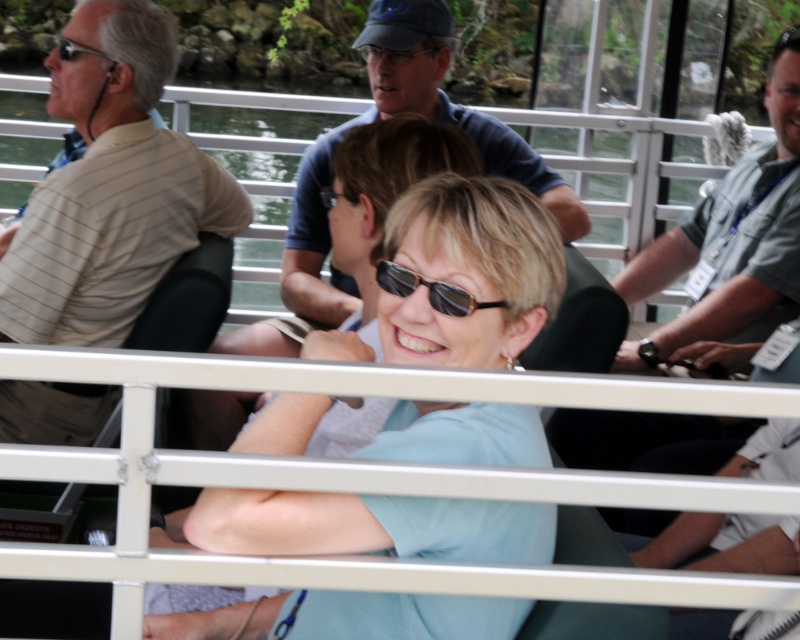
You are a photographer trying to capture a candid shot of the black plastic sunglasses at center without including the gray fabric shirt at right in the frame. Is this possible given their positions?

The gray fabric shirt at right is further to the viewer than the black plastic sunglasses at center, so the gray fabric shirt at right would block the view of the black plastic sunglasses at center. Therefore, it is not possible to capture the black plastic sunglasses at center without including the gray fabric shirt at right in the frame.

You are a photographer trying to capture a clear shot of the blue fabric shirt at center and the black plastic sunglasses at center. Which object is blocking the view of the other?

The blue fabric shirt at center is positioned over the black plastic sunglasses at center, so the blue fabric shirt at center is blocking the view of the black plastic sunglasses at center.

You are a photographer trying to capture a clear photo of the gray fabric shirt at right and the black plastic sunglasses at center. Since the camera has a limited focus range, which object should you prioritize focusing on to ensure it appears sharp?

The gray fabric shirt at right should be prioritized for focus because it is larger in size compared to the black plastic sunglasses at center, making it more likely to be in focus if the focus range is limited.